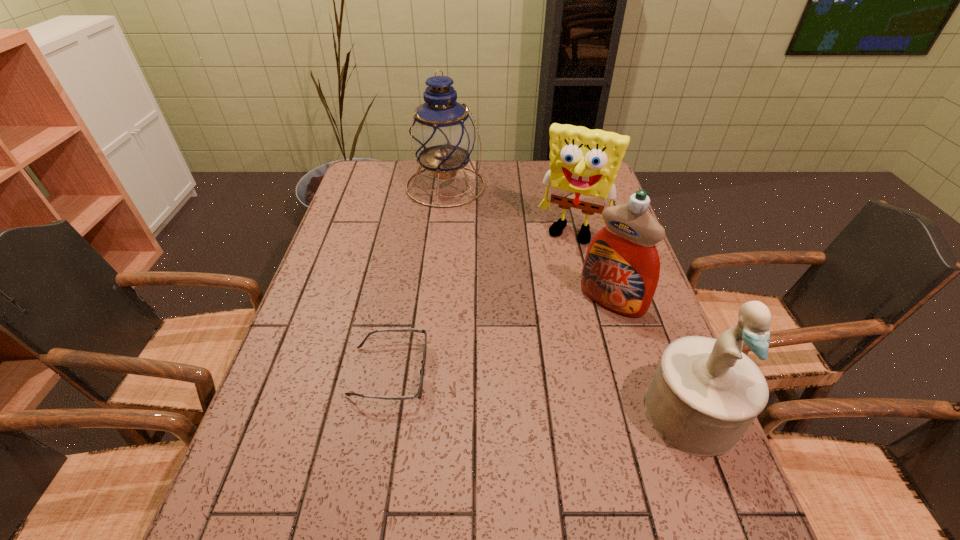
Identify the location of vacant area located on the front-facing side of the farthest object. The height and width of the screenshot is (540, 960). (500, 273).

Identify the location of vacant space located on the front-facing side of the farthest object. (472, 228).

You are a GUI agent. You are given a task and a screenshot of the screen. Output one action in this format:
    pyautogui.click(x=<x>, y=<y>)
    Task: Click on the vacant space positioned 0.130m on the front-facing side of the farthest object
    
    Given the screenshot: What is the action you would take?
    pyautogui.click(x=472, y=228)

At what (x,y) coordinates should I click in order to perform the action: click on free space located on the front surface of the third farthest object. Please return your answer as a coordinate pair (x, y). Looking at the image, I should click on (517, 409).

Locate an element on the screen. The width and height of the screenshot is (960, 540). vacant space located 0.090m on the front surface of the third farthest object is located at coordinates (578, 337).

The image size is (960, 540). Find the location of `blank area located on the front surface of the third farthest object`. blank area located on the front surface of the third farthest object is located at coordinates (526, 399).

Where is `object at the far edge`? The width and height of the screenshot is (960, 540). object at the far edge is located at coordinates (442, 136).

I want to click on object present at the near edge, so click(x=705, y=394).

Where is `figurine at the right edge`? figurine at the right edge is located at coordinates (705, 394).

This screenshot has width=960, height=540. Identify the location of sponge at the right edge. (584, 163).